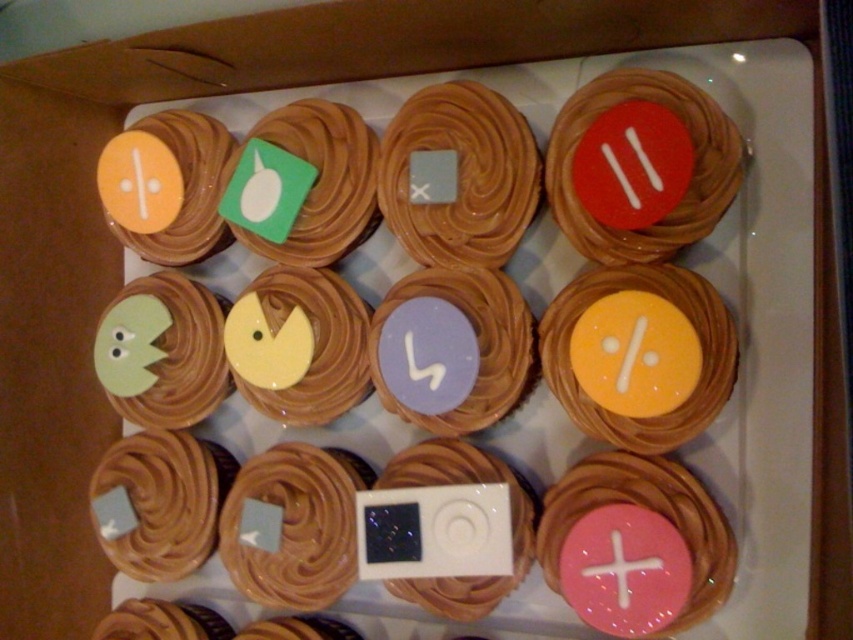
Question: Is red matte button at upper right below pink glossy cross at center?

Choices:
 (A) yes
 (B) no

Answer: (B)

Question: Based on their relative distances, which object is nearer to the pink glossy cupcake at lower right?

Choices:
 (A) matte yellow icing at center right
 (B) pink glossy cross at center

Answer: (B)

Question: Which point appears closest to the camera in this image?

Choices:
 (A) (682, 214)
 (B) (630, 568)
 (C) (494, 458)

Answer: (B)

Question: Can you confirm if pink glossy cupcake at lower right is positioned below pink glossy cross at center?

Choices:
 (A) yes
 (B) no

Answer: (B)

Question: Which object appears farthest from the camera in this image?

Choices:
 (A) pink glossy cross at center
 (B) purple matte/painted at center
 (C) white glossy ipod at center

Answer: (B)

Question: Can you confirm if matte brown cupcake at center is positioned to the right of purple matte/painted at center?

Choices:
 (A) yes
 (B) no

Answer: (B)